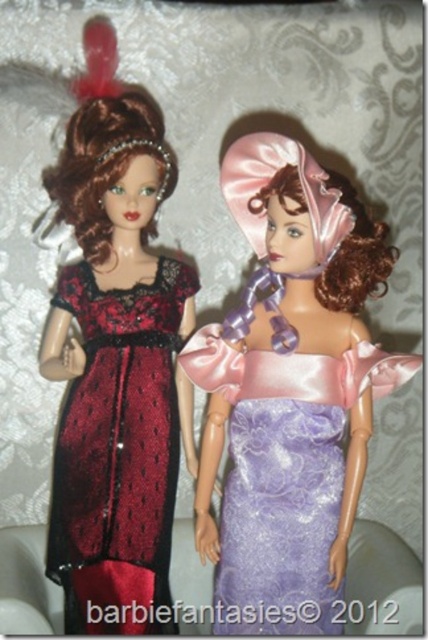
You are a customer in a doll store and want to know which dress is positioned lower between the lavender satin dress at center and the matte lace dress at left. Can you tell me?

The lavender satin dress at center is positioned lower than the matte lace dress at left.

You are a collector of vintage dolls and want to display them in a case. The lavender satin dress at center and the matte lace dress at left are both on a shelf. If you want to see both dresses clearly, which one should you move forward so that neither blocks the other?

The matte lace dress at left should be moved forward so it is in front of the lavender satin dress at center, ensuring both are visible without obstruction.

In the image of two dolls positioned side by side against a floral background, there is a specific point marked at coordinates (290,392). Which object from the scene is located exactly at this point?

The lavender satin dress at center is located exactly at point (290,392).